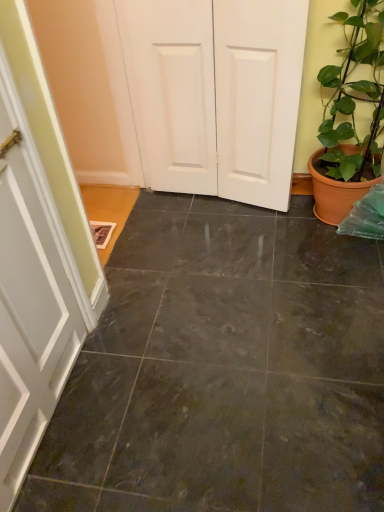
Locate an element on the screen. This screenshot has height=512, width=384. blank area beneath dark gray tile floor at center (from a real-world perspective) is located at coordinates (258, 366).